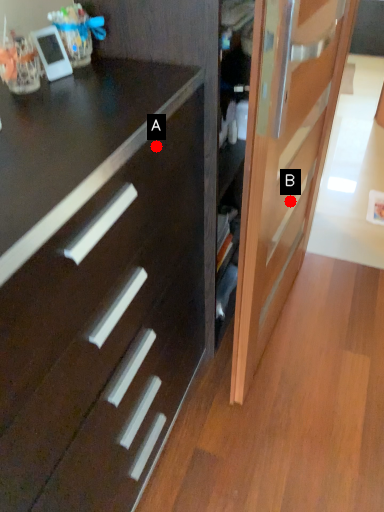
Question: Two points are circled on the image, labeled by A and B beside each circle. Which of the following is the closest to the observer?

Choices:
 (A) A is closer
 (B) B is closer

Answer: (A)